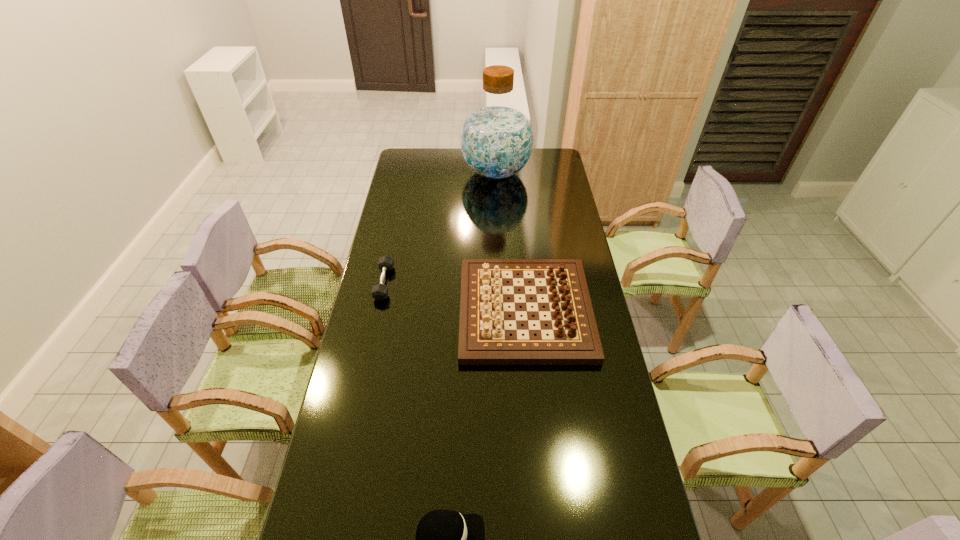
You are a GUI agent. You are given a task and a screenshot of the screen. Output one action in this format:
    pyautogui.click(x=<x>, y=<y>)
    Task: Click on the free space between the gameboard and the dumbbell
    The width and height of the screenshot is (960, 540).
    Given the screenshot: What is the action you would take?
    pyautogui.click(x=455, y=296)

You are a GUI agent. You are given a task and a screenshot of the screen. Output one action in this format:
    pyautogui.click(x=<x>, y=<y>)
    Task: Click on the free point between the shortest object and the third shortest object
    Image resolution: width=960 pixels, height=540 pixels.
    Given the screenshot: What is the action you would take?
    pyautogui.click(x=455, y=296)

Locate an element on the screen. unoccupied position between the third shortest object and the water jug is located at coordinates click(511, 241).

At what (x,y) coordinates should I click in order to perform the action: click on object that ranks as the closest to the farthest object. Please return your answer as a coordinate pair (x, y). The height and width of the screenshot is (540, 960). Looking at the image, I should click on pos(484,333).

Identify the location of object that is the closest to the shortest object. The width and height of the screenshot is (960, 540). (484, 333).